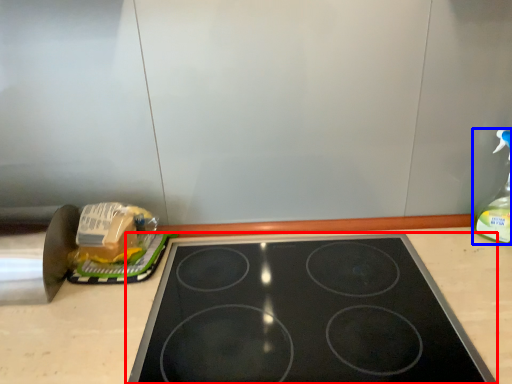
Question: Among these objects, which one is nearest to the camera, gas stove (highlighted by a red box) or bottle (highlighted by a blue box)?

Choices:
 (A) gas stove
 (B) bottle

Answer: (A)